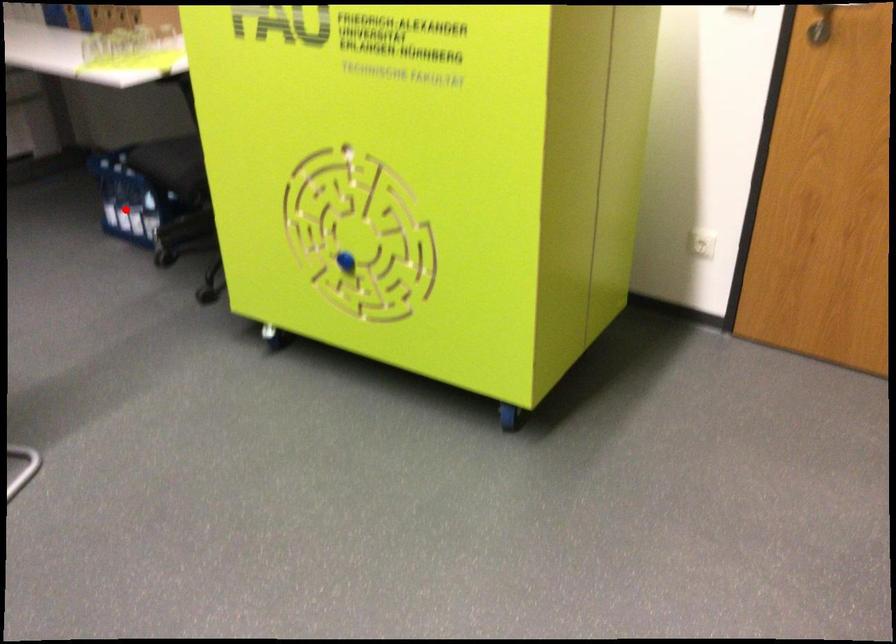
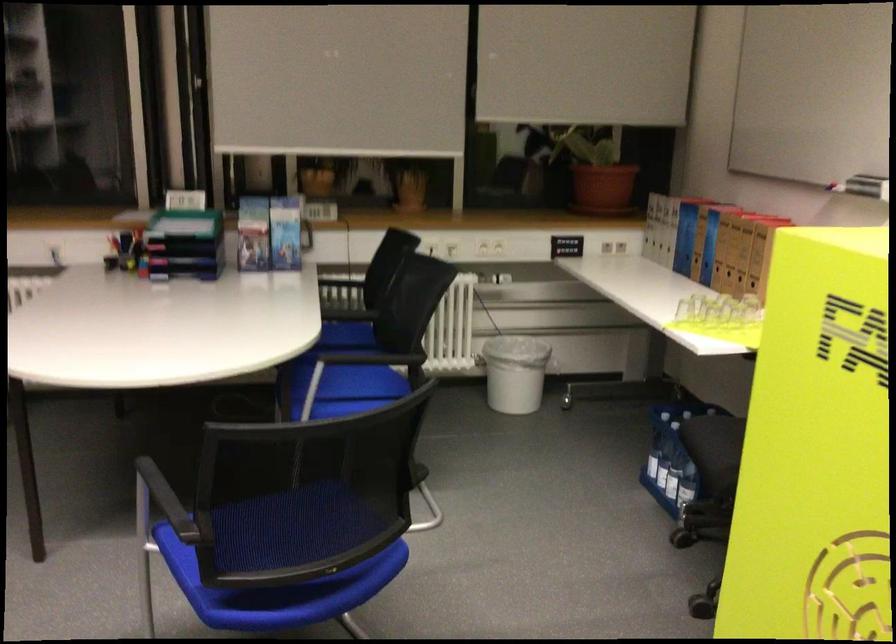
Question: A red point is marked in image1. In image2, is the corresponding 3D point closer to the camera or farther? Reply with the corresponding letter.

Choices:
 (A) The corresponding 3D point is closer.
 (B) The corresponding 3D point is farther.

Answer: (A)